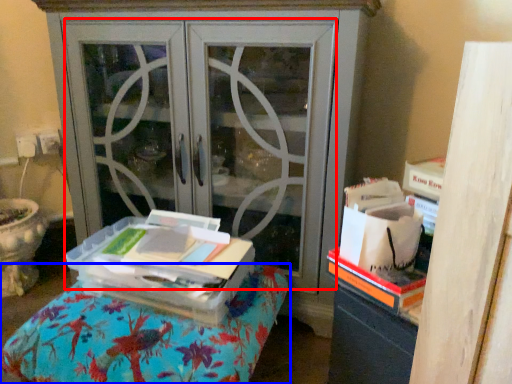
Question: Which object is closer to the camera taking this photo, screen door (highlighted by a red box) or furniture (highlighted by a blue box)?

Choices:
 (A) screen door
 (B) furniture

Answer: (B)